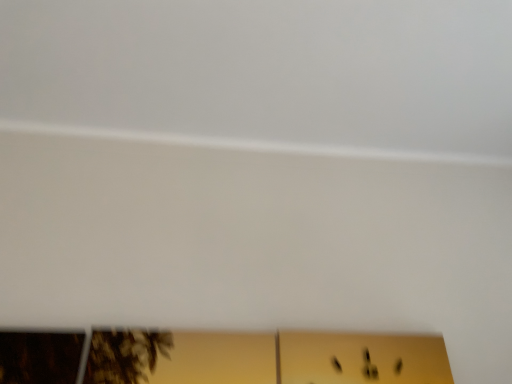
The width and height of the screenshot is (512, 384). What are the coordinates of `dark wood window at lower left` in the screenshot? It's located at (40, 357).

What do you see at coordinates (40, 357) in the screenshot? I see `dark wood window at lower left` at bounding box center [40, 357].

Locate an element on the screen. This screenshot has height=384, width=512. dark wood window at lower left is located at coordinates (40, 357).